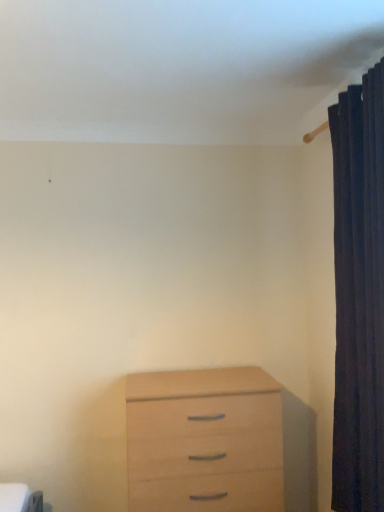
Question: Is dark fabric curtain at right directly adjacent to light wood chest of drawers at lower center?

Choices:
 (A) no
 (B) yes

Answer: (A)

Question: Is dark fabric curtain at right not within light wood chest of drawers at lower center?

Choices:
 (A) no
 (B) yes

Answer: (B)

Question: Can you confirm if dark fabric curtain at right is smaller than light wood chest of drawers at lower center?

Choices:
 (A) yes
 (B) no

Answer: (A)

Question: Is light wood chest of drawers at lower center at the back of dark fabric curtain at right?

Choices:
 (A) yes
 (B) no

Answer: (B)

Question: Considering the relative sizes of dark fabric curtain at right and light wood chest of drawers at lower center in the image provided, is dark fabric curtain at right thinner than light wood chest of drawers at lower center?

Choices:
 (A) yes
 (B) no

Answer: (A)

Question: Could light wood chest of drawers at lower center be considered to be inside dark fabric curtain at right?

Choices:
 (A) yes
 (B) no

Answer: (B)

Question: Does light wood chest of drawers at lower center appear on the right side of dark fabric curtain at right?

Choices:
 (A) no
 (B) yes

Answer: (A)

Question: Does light wood chest of drawers at lower center have a greater width compared to dark fabric curtain at right?

Choices:
 (A) yes
 (B) no

Answer: (A)

Question: From the image's perspective, is light wood chest of drawers at lower center below dark fabric curtain at right?

Choices:
 (A) no
 (B) yes

Answer: (B)

Question: Is light wood chest of drawers at lower center outside of dark fabric curtain at right?

Choices:
 (A) yes
 (B) no

Answer: (A)

Question: Is light wood chest of drawers at lower center smaller than dark fabric curtain at right?

Choices:
 (A) yes
 (B) no

Answer: (B)

Question: Is light wood chest of drawers at lower center not close to dark fabric curtain at right?

Choices:
 (A) yes
 (B) no

Answer: (B)

Question: Considering their positions, is dark fabric curtain at right located in front of or behind light wood chest of drawers at lower center?

Choices:
 (A) behind
 (B) front

Answer: (B)